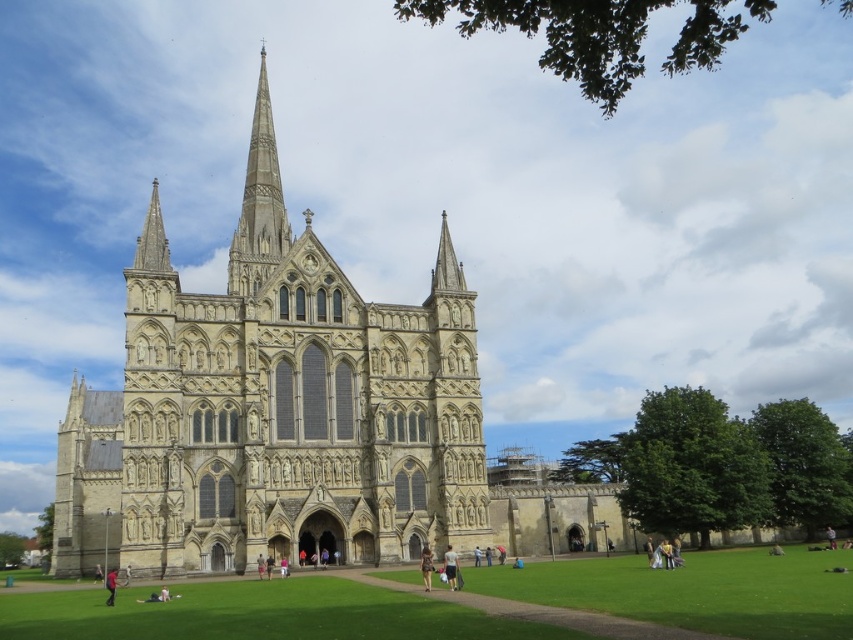
Does smooth stone spire at center have a greater width compared to red fabric person at lower left?

Yes.

Can you confirm if smooth stone spire at center is positioned above red fabric person at lower left?

Yes.

Looking at this image, measure the distance between smooth stone spire at center and camera.

211.21 feet

Where is `smooth stone spire at center`? Image resolution: width=853 pixels, height=640 pixels. smooth stone spire at center is located at coordinates (259, 204).

Based on the photo, is green grass at lower center smaller than red fabric person at lower left?

Actually, green grass at lower center might be larger than red fabric person at lower left.

Between green grass at lower center and red fabric person at lower left, which one has more height?

green grass at lower center

Which is in front, point (326, 632) or point (109, 586)?

Point (326, 632) is more forward.

At what (x,y) coordinates should I click in order to perform the action: click on green grass at lower center. Please return your answer as a coordinate pair (x, y). The height and width of the screenshot is (640, 853). Looking at the image, I should click on (256, 614).

Can you confirm if light brown fabric bag at center is positioned above brown fabric dress at center?

Yes, light brown fabric bag at center is above brown fabric dress at center.

Which is behind, point (454, 572) or point (422, 576)?

Point (422, 576)

The width and height of the screenshot is (853, 640). Describe the element at coordinates (450, 566) in the screenshot. I see `light brown fabric bag at center` at that location.

You are a GUI agent. You are given a task and a screenshot of the screen. Output one action in this format:
    pyautogui.click(x=<x>, y=<y>)
    Task: Click on the light brown fabric bag at center
    
    Given the screenshot: What is the action you would take?
    pyautogui.click(x=450, y=566)